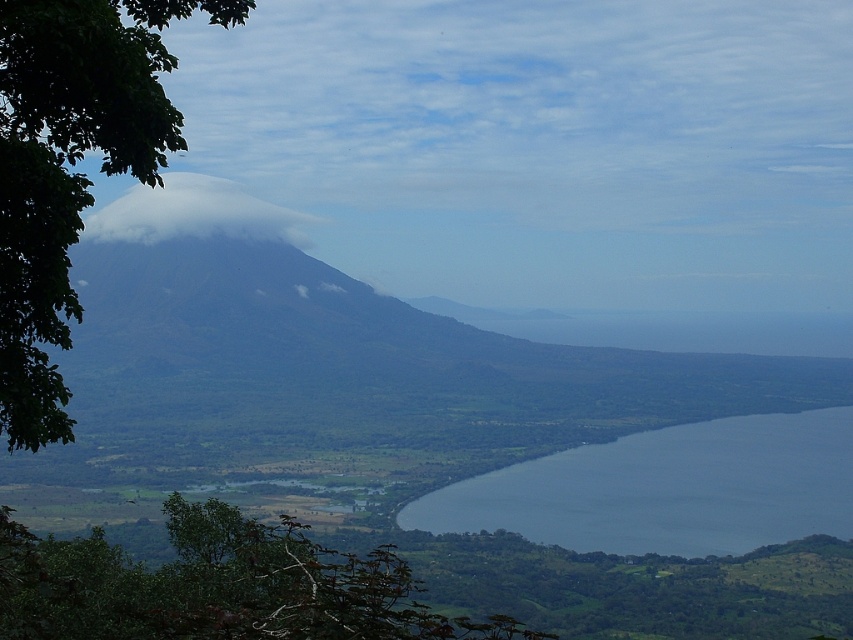
Looking at this image, you are a hiker standing at the center of the landscape. You notice the green leafy tree at lower left and the blue water at lower right. Which object appears larger in the scene?

The green leafy tree at lower left appears larger than the blue water at lower right.